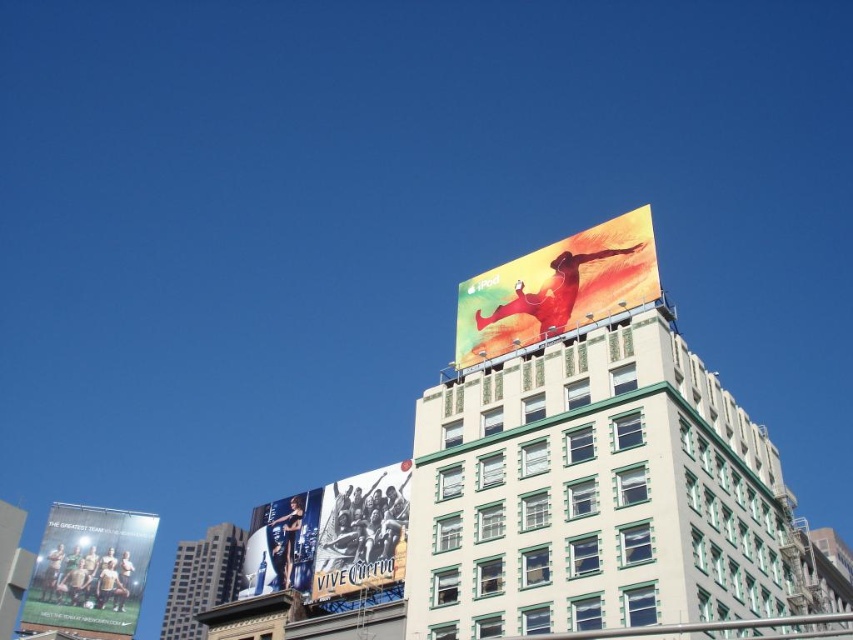
You are a photographer trying to capture both the white concrete building at upper center and the matte white soccer team at lower left in a single shot. Based on their positions and sizes, which object should you focus on first to ensure both are in frame?

You should focus on the white concrete building at upper center first since it is wider than the matte white soccer team at lower left, ensuring it fits properly before adjusting for the smaller object.

You are standing in front of the large building with the iPod billboard. You notice two points marked on the building. The first point is at coordinates point [703,401] and the second is at point [97,564]. Which point is closer to you?

Point [703,401] is closer to the camera than point [97,564].